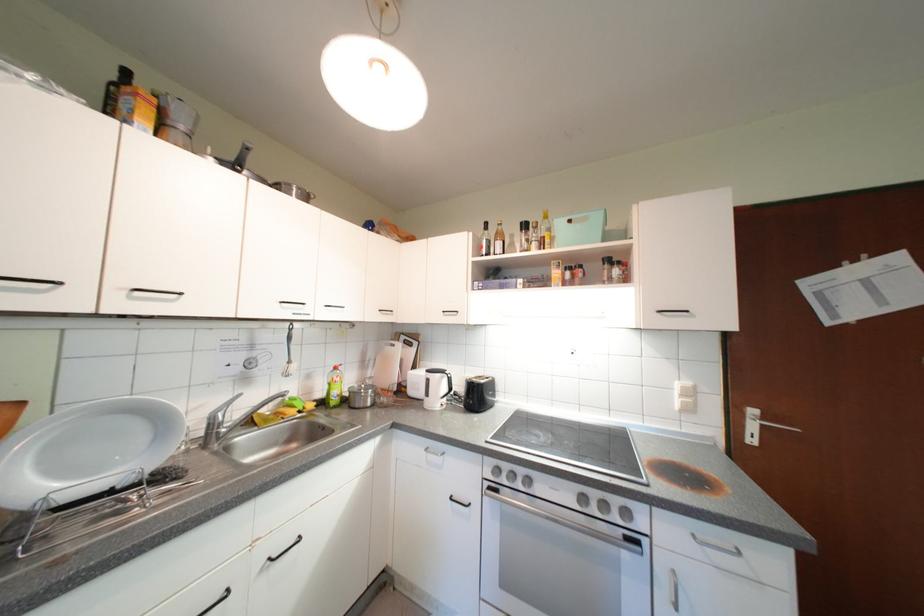
Identify the location of silver door handle. The image size is (924, 616). (777, 426).